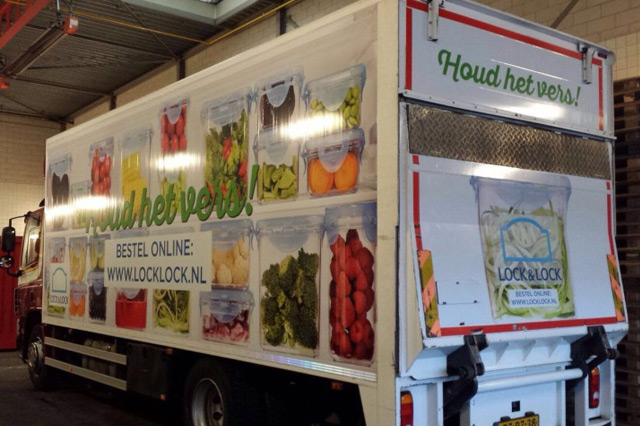
Find the location of a particular element. door is located at coordinates (33, 289).